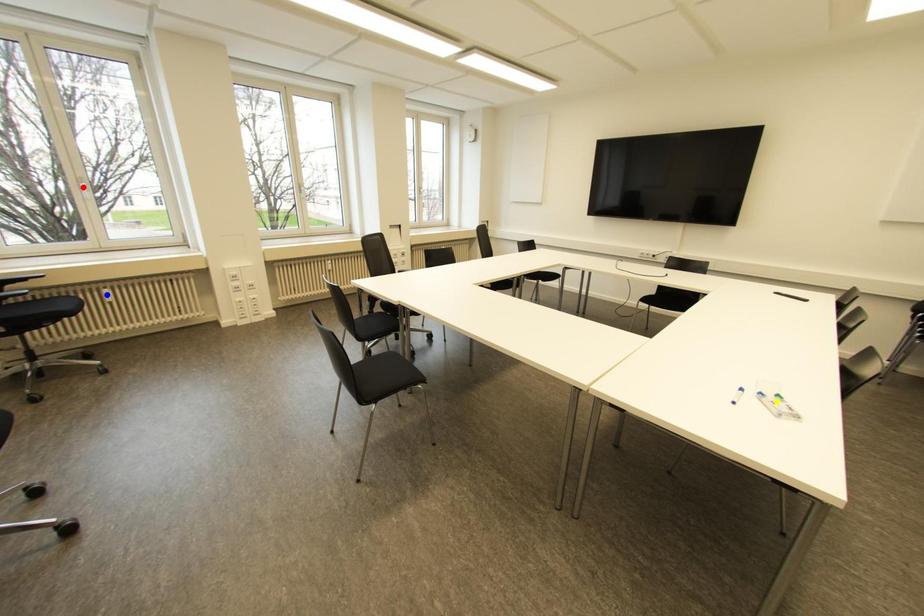
Order these from nearest to farthest:
1. red point
2. yellow point
3. blue point

1. red point
2. blue point
3. yellow point